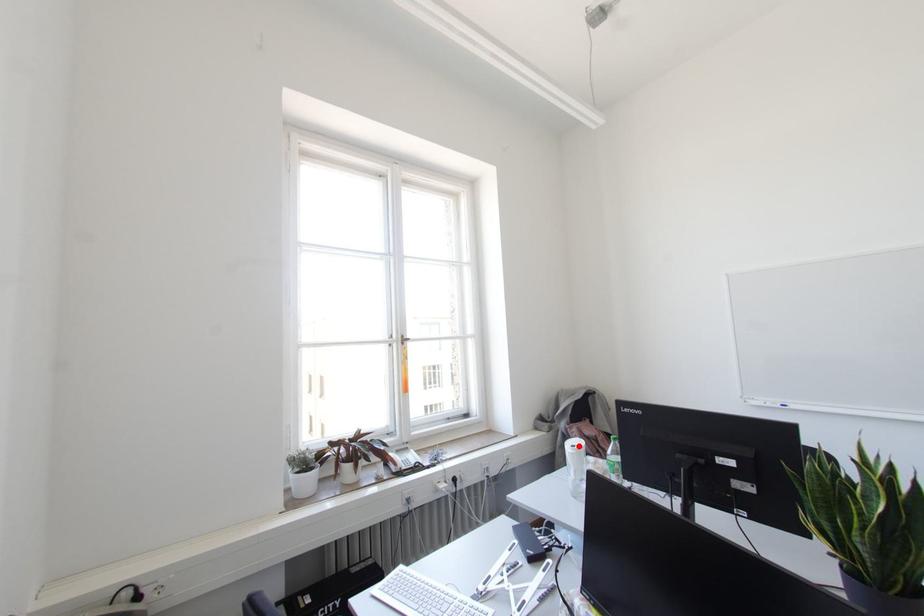
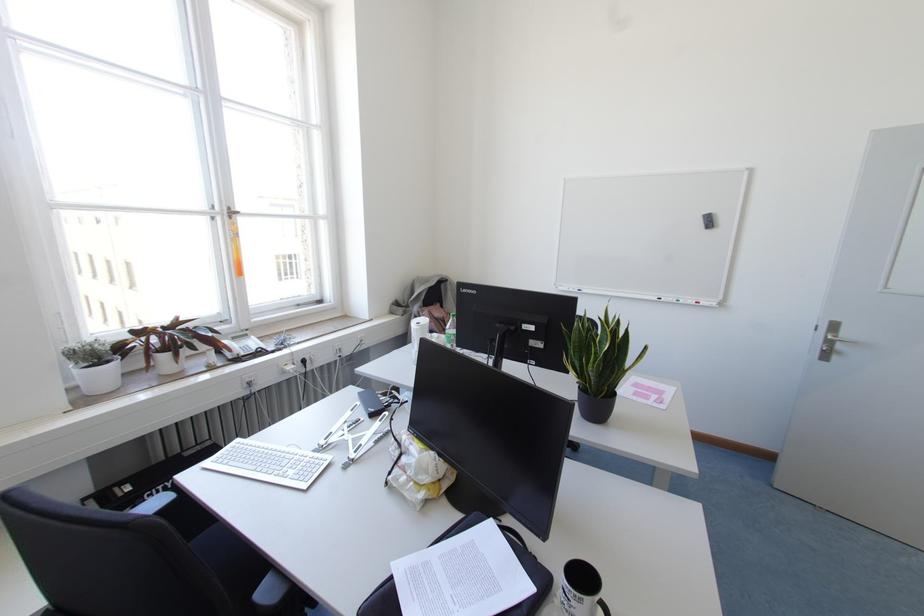
Question: I am providing you with two images of the same scene from different viewpoints. A red point is marked on the first image. Is the red point's position out of view in image 2?

Choices:
 (A) Yes
 (B) No

Answer: (B)